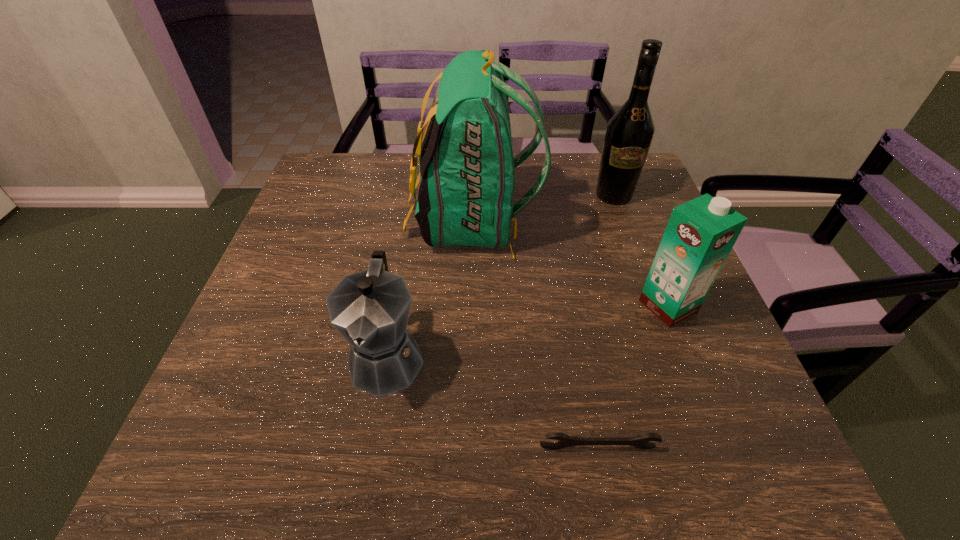
Image resolution: width=960 pixels, height=540 pixels. Find the location of `vacant space at the far right corner`. vacant space at the far right corner is located at coordinates (646, 170).

The image size is (960, 540). I want to click on vacant area between the backpack and the wine bottle, so click(542, 208).

Identify the location of free space that is in between the wine bottle and the fourth tallest object. (500, 276).

Identify the location of free space that is in between the coffeepot and the wine bottle. [x=500, y=276].

The height and width of the screenshot is (540, 960). I want to click on vacant space in between the wrench and the carton, so point(634,376).

Image resolution: width=960 pixels, height=540 pixels. Find the location of `free space between the backpack and the wine bottle`. free space between the backpack and the wine bottle is located at coordinates (542, 208).

Locate an element on the screen. Image resolution: width=960 pixels, height=540 pixels. free space that is in between the coffeepot and the backpack is located at coordinates (429, 289).

At what (x,y) coordinates should I click in order to perform the action: click on vacant space that is in between the shortest object and the backpack. Please return your answer as a coordinate pair (x, y). This screenshot has height=540, width=960. Looking at the image, I should click on (535, 335).

At what (x,y) coordinates should I click in order to perform the action: click on vacant space that's between the wine bottle and the carton. Please return your answer as a coordinate pair (x, y). Looking at the image, I should click on (641, 251).

Where is `empty location between the wine bottle and the wrench`? The height and width of the screenshot is (540, 960). empty location between the wine bottle and the wrench is located at coordinates (606, 321).